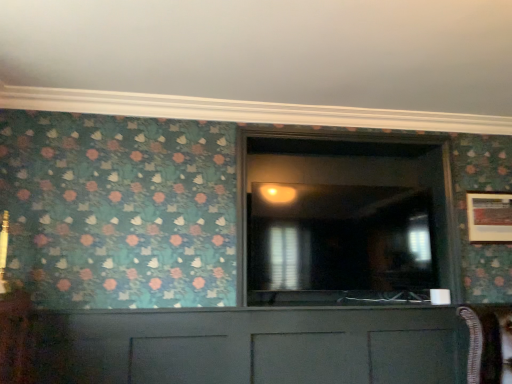
Question: From the image's perspective, does wooden picture frame at right appear higher than transparent glass door at center?

Choices:
 (A) no
 (B) yes

Answer: (A)

Question: Is wooden picture frame at right in contact with transparent glass door at center?

Choices:
 (A) yes
 (B) no

Answer: (B)

Question: Is wooden picture frame at right shorter than transparent glass door at center?

Choices:
 (A) no
 (B) yes

Answer: (B)

Question: From a real-world perspective, is wooden picture frame at right over transparent glass door at center?

Choices:
 (A) no
 (B) yes

Answer: (A)

Question: Is wooden picture frame at right positioned in front of transparent glass door at center?

Choices:
 (A) no
 (B) yes

Answer: (A)

Question: Considering the relative sizes of wooden picture frame at right and transparent glass door at center in the image provided, is wooden picture frame at right wider than transparent glass door at center?

Choices:
 (A) yes
 (B) no

Answer: (B)

Question: Is transparent glass door at center to the right of matte gray cabinet at center from the viewer's perspective?

Choices:
 (A) yes
 (B) no

Answer: (A)

Question: Considering the relative sizes of transparent glass door at center and matte gray cabinet at center in the image provided, is transparent glass door at center smaller than matte gray cabinet at center?

Choices:
 (A) no
 (B) yes

Answer: (A)

Question: Does transparent glass door at center appear on the left side of matte gray cabinet at center?

Choices:
 (A) yes
 (B) no

Answer: (B)

Question: From a real-world perspective, is transparent glass door at center physically below matte gray cabinet at center?

Choices:
 (A) no
 (B) yes

Answer: (A)

Question: From the image's perspective, is transparent glass door at center on top of matte gray cabinet at center?

Choices:
 (A) yes
 (B) no

Answer: (A)

Question: Could you tell me if transparent glass door at center is facing matte gray cabinet at center?

Choices:
 (A) yes
 (B) no

Answer: (B)

Question: Is matte gray cabinet at center to the right of transparent glass door at center from the viewer's perspective?

Choices:
 (A) yes
 (B) no

Answer: (B)